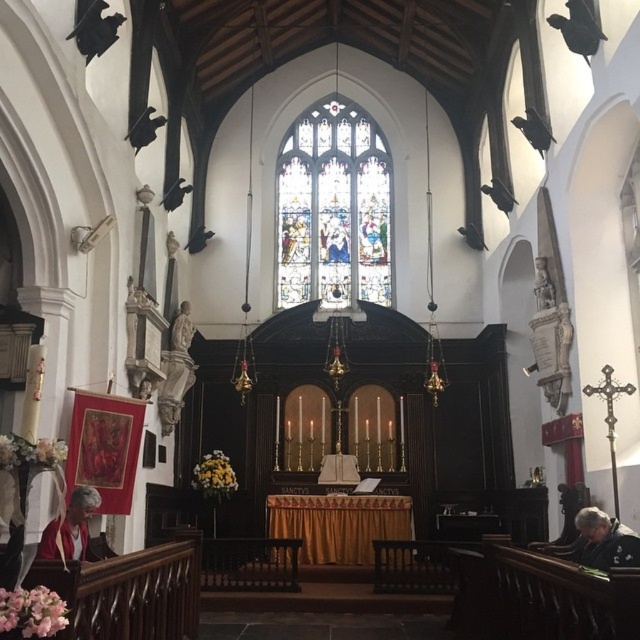
Question: Which of the following is the closest to the observer?

Choices:
 (A) (374, 241)
 (B) (77, 528)

Answer: (B)

Question: Can you confirm if gray fabric jacket at lower right is smaller than matte red robe at lower left?

Choices:
 (A) yes
 (B) no

Answer: (A)

Question: Among these points, which one is farthest from the camera?

Choices:
 (A) (636, 564)
 (B) (77, 490)

Answer: (B)

Question: Does gray fabric jacket at lower right have a lesser width compared to matte red robe at lower left?

Choices:
 (A) yes
 (B) no

Answer: (B)

Question: Can you confirm if stained glass window at center is thinner than gray fabric jacket at lower right?

Choices:
 (A) yes
 (B) no

Answer: (B)

Question: Among these points, which one is farthest from the camera?

Choices:
 (A) (582, 520)
 (B) (337, 173)
 (C) (96, 504)

Answer: (B)